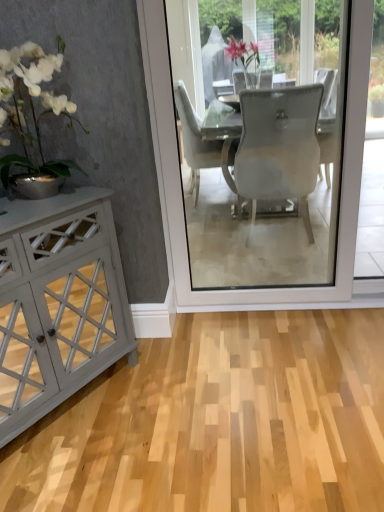
Question: Considering the relative positions of transparent glass screen door at center and matte gray cabinet at left in the image provided, is transparent glass screen door at center to the right of matte gray cabinet at left from the viewer's perspective?

Choices:
 (A) yes
 (B) no

Answer: (A)

Question: From the image's perspective, does transparent glass screen door at center appear higher than matte gray cabinet at left?

Choices:
 (A) no
 (B) yes

Answer: (B)

Question: Does transparent glass screen door at center have a larger size compared to matte gray cabinet at left?

Choices:
 (A) no
 (B) yes

Answer: (B)

Question: Does transparent glass screen door at center appear on the left side of matte gray cabinet at left?

Choices:
 (A) no
 (B) yes

Answer: (A)

Question: Is transparent glass screen door at center surrounding matte gray cabinet at left?

Choices:
 (A) yes
 (B) no

Answer: (B)

Question: Is transparent glass screen door at center with matte gray cabinet at left?

Choices:
 (A) no
 (B) yes

Answer: (A)

Question: Is white glossy vase at left to the left of transparent glass screen door at center from the viewer's perspective?

Choices:
 (A) yes
 (B) no

Answer: (A)

Question: Would you consider white glossy vase at left to be distant from transparent glass screen door at center?

Choices:
 (A) no
 (B) yes

Answer: (A)

Question: Considering the relative positions of white glossy vase at left and transparent glass screen door at center in the image provided, is white glossy vase at left behind transparent glass screen door at center?

Choices:
 (A) no
 (B) yes

Answer: (A)

Question: Is white glossy vase at left turned away from transparent glass screen door at center?

Choices:
 (A) no
 (B) yes

Answer: (A)

Question: Is white glossy vase at left bigger than transparent glass screen door at center?

Choices:
 (A) no
 (B) yes

Answer: (A)

Question: Is white glossy vase at left in contact with transparent glass screen door at center?

Choices:
 (A) yes
 (B) no

Answer: (B)

Question: Does matte gray cabinet at left come behind transparent glass screen door at center?

Choices:
 (A) yes
 (B) no

Answer: (B)